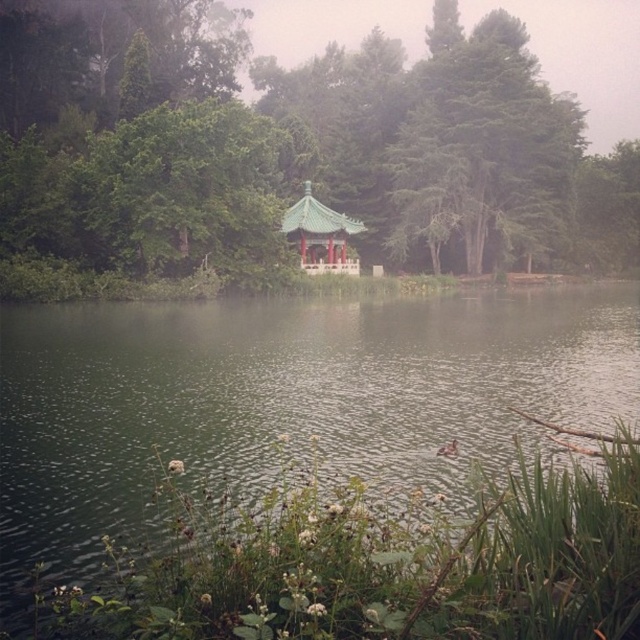
Question: Is green leafy tree at center to the right of green textured tree at upper center from the viewer's perspective?

Choices:
 (A) yes
 (B) no

Answer: (B)

Question: Does green leafy tree at center have a lesser width compared to green liquid water at center?

Choices:
 (A) yes
 (B) no

Answer: (B)

Question: Which object appears closest to the camera in this image?

Choices:
 (A) green leafy tree at center
 (B) green textured tree at upper center
 (C) green glazed pagoda at center

Answer: (A)

Question: Based on their relative distances, which object is nearer to the green liquid water at center?

Choices:
 (A) green glazed pagoda at center
 (B) green textured tree at upper center
 (C) green leafy tree at center

Answer: (A)

Question: Which is farther from the green liquid water at center?

Choices:
 (A) green glazed pagoda at center
 (B) green leafy tree at center

Answer: (B)

Question: Is the position of green textured tree at upper center more distant than that of green glazed pagoda at center?

Choices:
 (A) no
 (B) yes

Answer: (B)